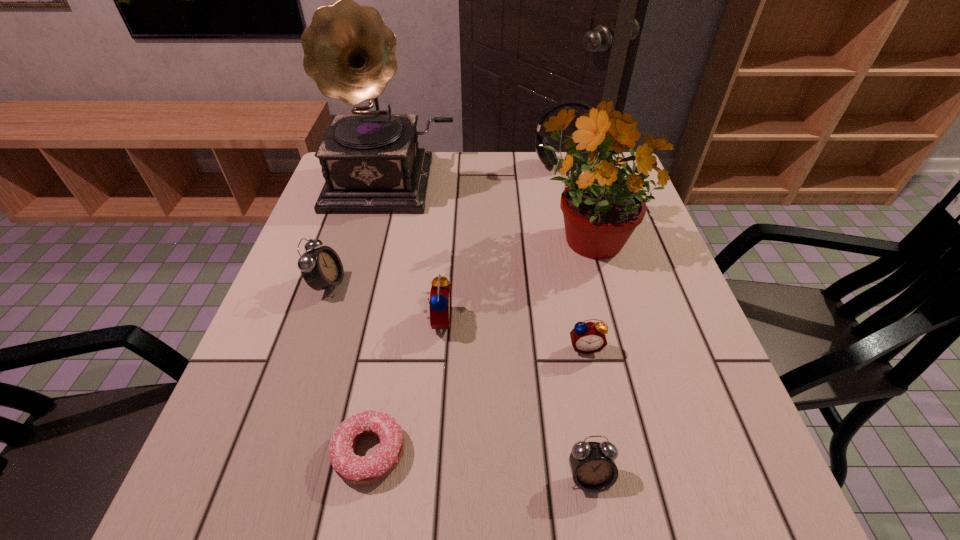
Locate an element on the screen. the right red alarm clock is located at coordinates (586, 338).

This screenshot has height=540, width=960. I want to click on the second nearest alarm clock, so click(x=586, y=338).

Locate an element on the screen. the smaller white alarm clock is located at coordinates (592, 464).

The height and width of the screenshot is (540, 960). I want to click on the nearer white alarm clock, so click(592, 464).

Find the location of a particular element. The width and height of the screenshot is (960, 540). pink doughnut is located at coordinates pyautogui.click(x=354, y=469).

This screenshot has width=960, height=540. I want to click on the shortest object, so click(x=354, y=469).

Where is `free space located on the horn of the golden record player`? free space located on the horn of the golden record player is located at coordinates (353, 333).

You are a GUI agent. You are given a task and a screenshot of the screen. Output one action in this format:
    pyautogui.click(x=<x>, y=<y>)
    Task: Click on the vacant space located on the left of the red flowerpot
    The width and height of the screenshot is (960, 540).
    Given the screenshot: What is the action you would take?
    pyautogui.click(x=462, y=235)

Image resolution: width=960 pixels, height=540 pixels. In order to click on vacant space located on the ear cups of the headset in this screenshot , I will do `click(574, 210)`.

You are a GUI agent. You are given a task and a screenshot of the screen. Output one action in this format:
    pyautogui.click(x=<x>, y=<y>)
    Task: Click on the free space located on the front-facing side of the third alarm clock from right to left
    
    Given the screenshot: What is the action you would take?
    pyautogui.click(x=594, y=321)